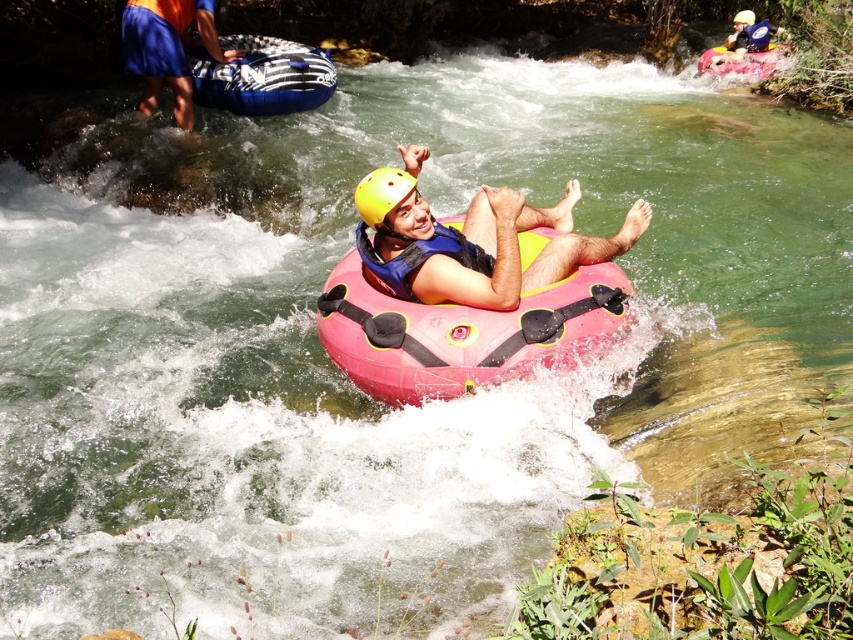
Question: Based on their relative distances, which object is farther from the blue rubber raft at upper center?

Choices:
 (A) matte pink tube at center
 (B) pink rubber raft at center
 (C) pink rubber raft at upper right

Answer: (C)

Question: Which point is closer to the camera taking this photo?

Choices:
 (A) (706, 70)
 (B) (428, 353)
 (C) (491, 296)

Answer: (B)

Question: Can you confirm if blue fabric shorts at upper left is positioned below pink rubber raft at upper right?

Choices:
 (A) yes
 (B) no

Answer: (A)

Question: Which point is farther to the camera?

Choices:
 (A) (279, 76)
 (B) (735, 12)
 (C) (383, 193)
 (D) (379, 253)

Answer: (B)

Question: Is matte pink tube at center in front of yellow matte helmet at upper center?

Choices:
 (A) no
 (B) yes

Answer: (B)

Question: Does matte pink tube at center come in front of yellow matte helmet at upper center?

Choices:
 (A) yes
 (B) no

Answer: (A)